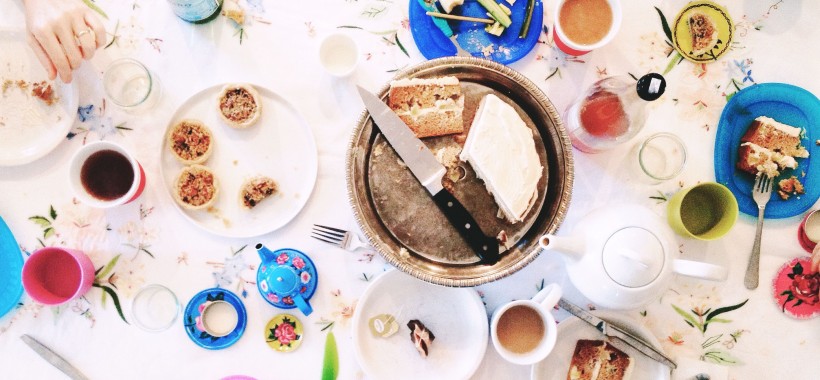
Find the location of a particular element. The image size is (820, 380). tray is located at coordinates (552, 213).